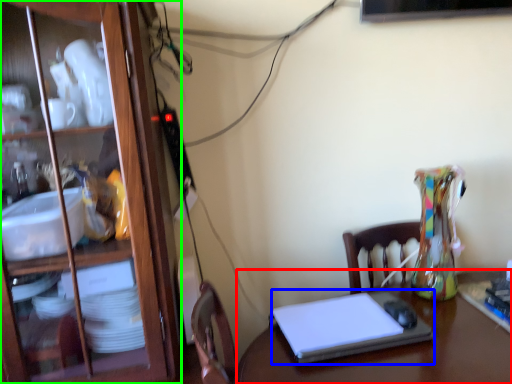
Question: Based on their relative distances, which object is nearer to desk (highlighted by a red box)? Choose from laptop (highlighted by a blue box) and cabinetry (highlighted by a green box).

Choices:
 (A) laptop
 (B) cabinetry

Answer: (A)